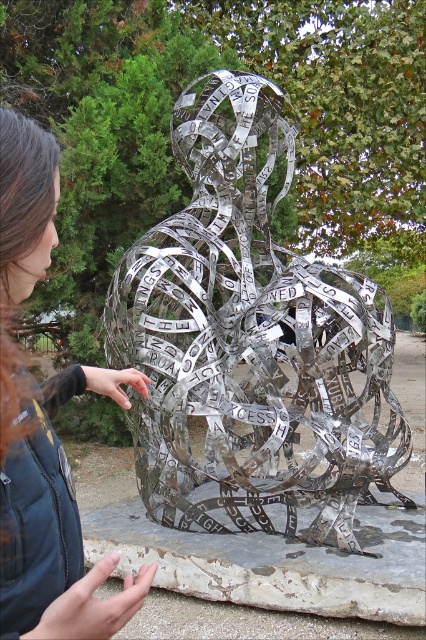
You are standing at the center of the park and see the metallic silver sculpture at center and the dark blue jacket at center. If you want to touch both objects, which one do you need to reach for first?

The metallic silver sculpture at center is 4.50 feet away from dark blue jacket at center, so you need to reach for the dark blue jacket at center first since it is closer to you.

You are an artist standing in front of the metallic silver sculpture at center and the dark blue jacket at center. You want to know which object takes up more space in the image. Which one is larger?

The metallic silver sculpture at center is bigger than the dark blue jacket at center, so the sculpture takes up more space in the image.

From the picture: You are a photographer trying to capture the metallic silver sculpture at center and the dark blue jacket at center in a single frame. Which object should you focus on first to ensure both are in the frame without moving the camera?

The metallic silver sculpture at center is positioned over the dark blue jacket at center, so you should focus on the dark blue jacket at center first to ensure both are in the frame without moving the camera.